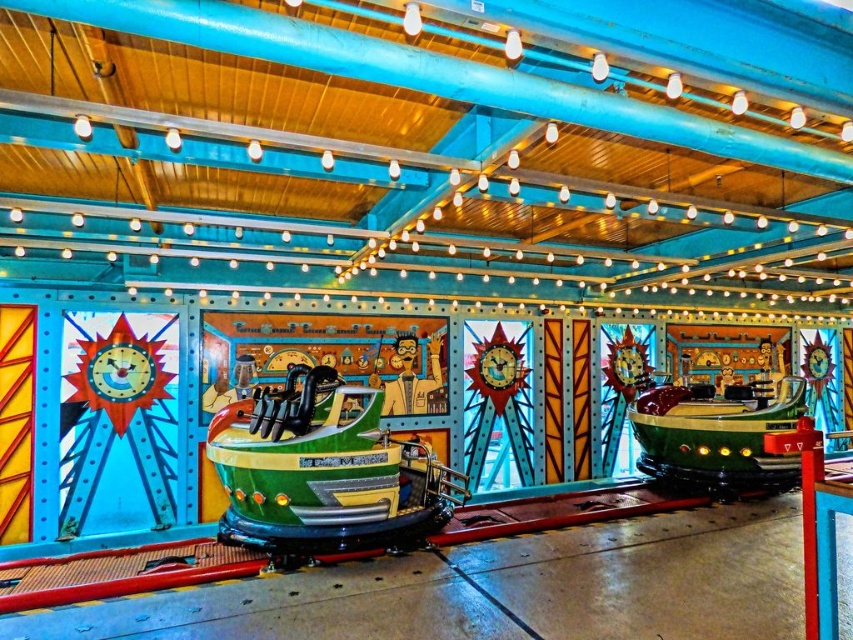
You are planning to load a large piece of equipment that is 2 meters wide into the space between the green shiny boat at center and the green matte boat at center. Based on the image, can you determine if there is enough space for the equipment?

The green shiny boat at center might be wider than green matte boat at center, so it is uncertain if there is enough space between them for the equipment. It is recommended to measure the actual distance before proceeding.

You are standing at the entrance of the amusement ride and see the point at coordinates (323, 472). Which object is this point located on?

The point at coordinates (323, 472) is located on the green shiny boat at center.

You are standing in front of the amusement ride and want to know how far the point at coordinates point (352, 472) is from you. Can you determine the distance?

The point (352, 472) is 17.51 feet away from the viewer.